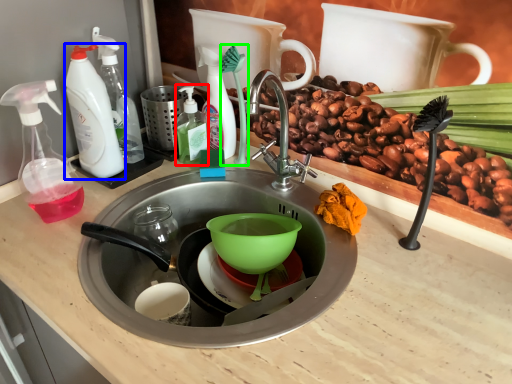
Question: Which object is the closest to the bottle (highlighted by a red box)? Choose among these: cleaning product (highlighted by a blue box) or brush (highlighted by a green box).

Choices:
 (A) cleaning product
 (B) brush

Answer: (B)